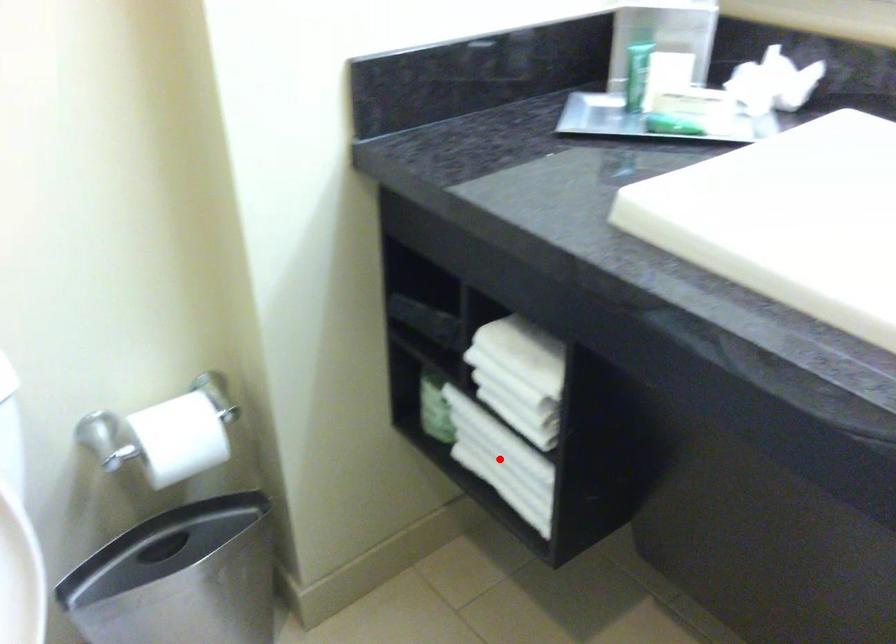
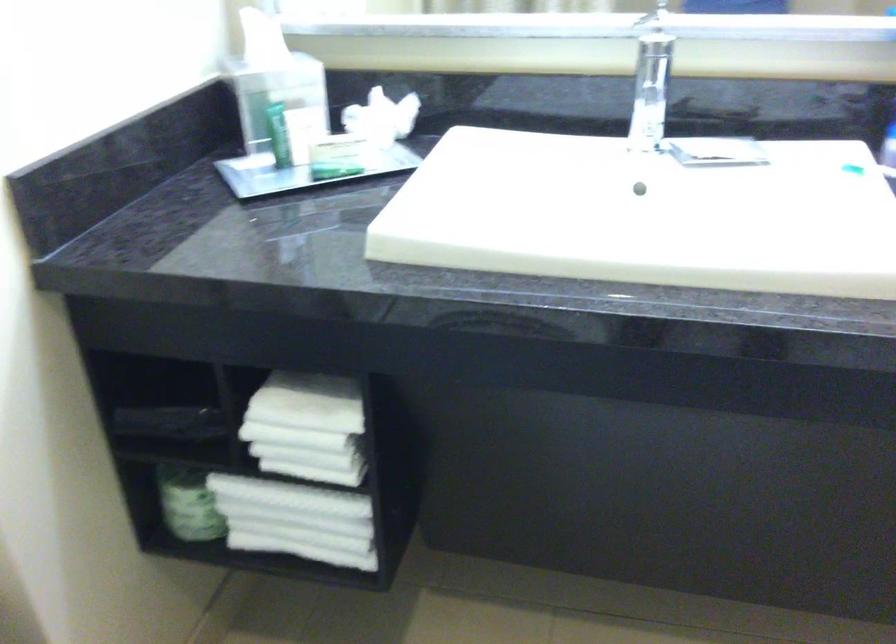
Where in the second image is the point corresponding to the highlighted location from the first image?

(296, 520)